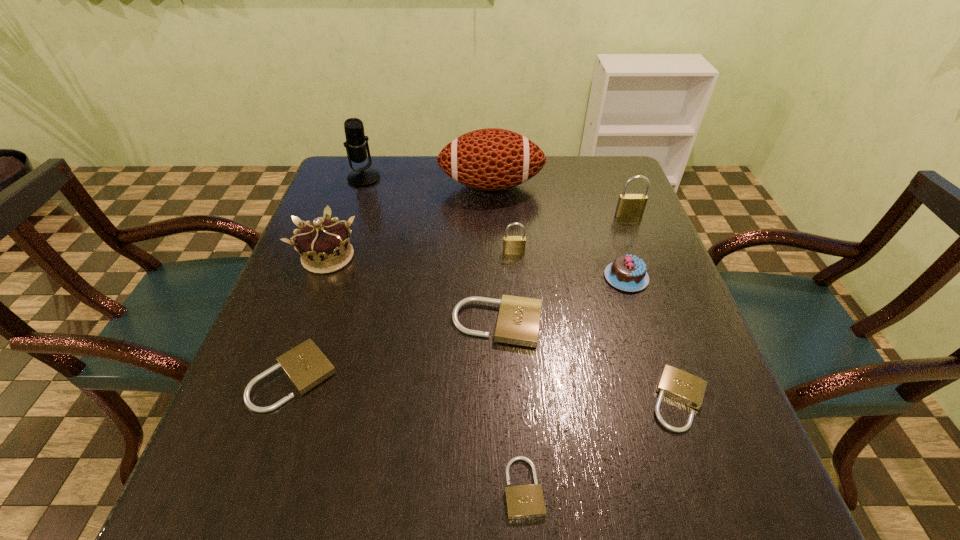
In order to click on microphone in this screenshot , I will do `click(356, 143)`.

The image size is (960, 540). In order to click on football in this screenshot , I will do pyautogui.click(x=491, y=159).

What are the coordinates of `the third farthest object` in the screenshot? It's located at (629, 205).

Locate an element on the screen. the farthest padlock is located at coordinates click(629, 205).

Identify the location of gold crown. The height and width of the screenshot is (540, 960). (324, 246).

Locate an element on the screen. This screenshot has width=960, height=540. the smaller brass padlock is located at coordinates (512, 245).

Identify the location of the left brass padlock. This screenshot has width=960, height=540. (512, 245).

You are a GUI agent. You are given a task and a screenshot of the screen. Output one action in this format:
    pyautogui.click(x=<x>, y=<y>)
    Task: Click on the chocolate cake
    This screenshot has width=960, height=540.
    Given the screenshot: What is the action you would take?
    pyautogui.click(x=628, y=273)

You are a GUI agent. You are given a task and a screenshot of the screen. Output one action in this format:
    pyautogui.click(x=<x>, y=<y>)
    Task: Click on the pink chocolate cake
    This screenshot has height=540, width=960.
    Given the screenshot: What is the action you would take?
    pyautogui.click(x=628, y=273)

Identify the location of the fourth shortest object. The width and height of the screenshot is (960, 540). (518, 321).